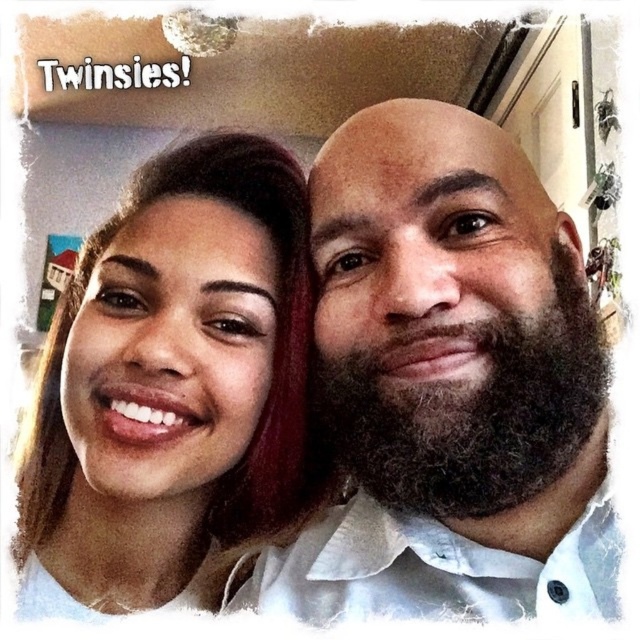
You are a photographer setting up for a group photo. You need to ensure that both the matte white shirt at left and the dark brown thick beard at right are clearly visible. Based on their positions, which one might be easier to capture in focus?

The matte white shirt at left will be easier to capture in focus because the dark brown thick beard at right is behind it, making it potentially more challenging to ensure both are in focus simultaneously.

You are trying to identify the location of the matte white shirt at left in the image. The coordinates provided are point (172, 378). Can you confirm if this point is located on the person on the left or the person on the right?

The point (172, 378) corresponds to the matte white shirt at left, which is located on the person on the left.

From the picture: You are a photographer trying to capture a group photo of two people. You have a camera with a lens that can focus on objects up to 6 inches apart. Based on the scene, can you confirm if the distance between the matte white shirt at left and dark brown thick beard at right is within the camera lens focus range?

The matte white shirt at left and dark brown thick beard at right are 6.05 inches apart from each other, which is slightly beyond the camera lens focus range of 6 inches. Therefore, the camera may struggle to focus on both subjects simultaneously.